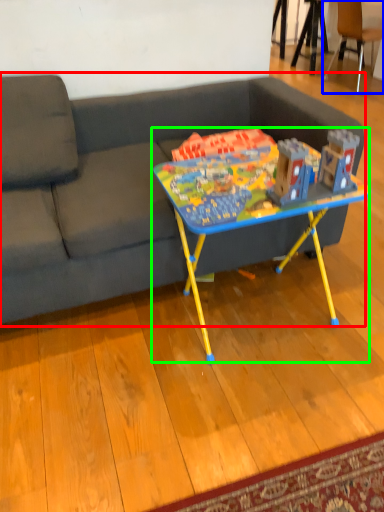
Question: Which object is the farthest from studio couch (highlighted by a red box)? Choose among these: chair (highlighted by a blue box) or table (highlighted by a green box).

Choices:
 (A) chair
 (B) table

Answer: (A)